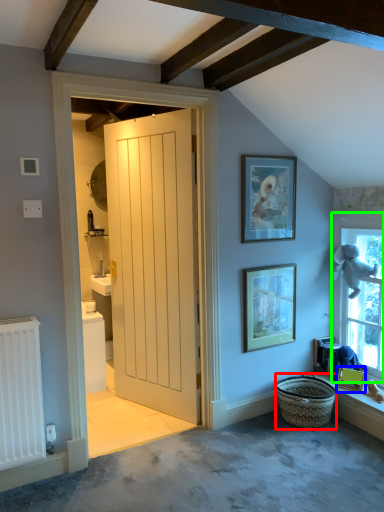
Question: Based on their relative distances, which object is nearer to basket (highlighted by a red box)? Choose from picture frame (highlighted by a blue box) and window (highlighted by a green box).

Choices:
 (A) picture frame
 (B) window

Answer: (A)